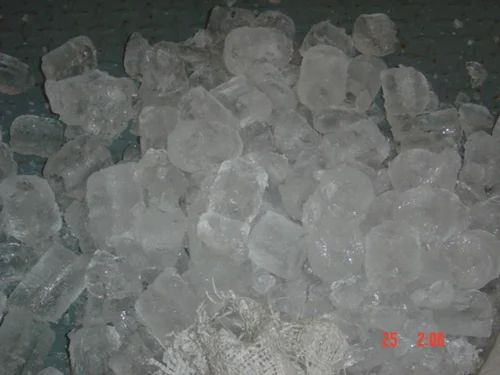
I want to click on loose weave fabric - burlap, so click(x=256, y=361).